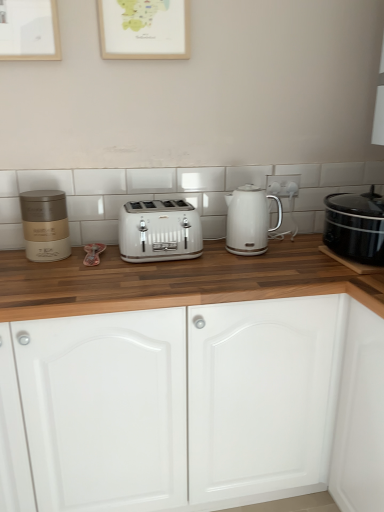
Question: Considering the relative positions of white metallic toaster at center and matte gold container at left in the image provided, is white metallic toaster at center behind matte gold container at left?

Choices:
 (A) no
 (B) yes

Answer: (B)

Question: Is white metallic toaster at center at the left side of matte gold container at left?

Choices:
 (A) yes
 (B) no

Answer: (B)

Question: Is white metallic toaster at center bigger than matte gold container at left?

Choices:
 (A) yes
 (B) no

Answer: (A)

Question: From the image's perspective, is white metallic toaster at center over matte gold container at left?

Choices:
 (A) yes
 (B) no

Answer: (B)

Question: From a real-world perspective, is white metallic toaster at center located beneath matte gold container at left?

Choices:
 (A) no
 (B) yes

Answer: (B)

Question: In terms of width, does wooden picture frame at upper center look wider or thinner when compared to white glossy electric kettle at center?

Choices:
 (A) wide
 (B) thin

Answer: (B)

Question: Considering the relative positions of wooden picture frame at upper center and white glossy electric kettle at center in the image provided, is wooden picture frame at upper center to the left or to the right of white glossy electric kettle at center?

Choices:
 (A) left
 (B) right

Answer: (A)

Question: Based on their sizes in the image, would you say wooden picture frame at upper center is bigger or smaller than white glossy electric kettle at center?

Choices:
 (A) small
 (B) big

Answer: (A)

Question: Is point (102, 34) closer or farther from the camera than point (259, 252)?

Choices:
 (A) farther
 (B) closer

Answer: (B)

Question: From the image's perspective, is white metallic toaster at center positioned above or below matte gold container at left?

Choices:
 (A) above
 (B) below

Answer: (B)

Question: Considering the positions of white metallic toaster at center and matte gold container at left in the image, is white metallic toaster at center bigger or smaller than matte gold container at left?

Choices:
 (A) big
 (B) small

Answer: (A)

Question: In the image, is white metallic toaster at center on the left side or the right side of matte gold container at left?

Choices:
 (A) left
 (B) right

Answer: (B)

Question: Does point (137, 208) appear closer or farther from the camera than point (34, 216)?

Choices:
 (A) farther
 (B) closer

Answer: (A)

Question: Considering the positions of matte gold container at left and wooden picture frame at upper center in the image, is matte gold container at left wider or thinner than wooden picture frame at upper center?

Choices:
 (A) wide
 (B) thin

Answer: (A)

Question: From the image's perspective, is matte gold container at left positioned above or below wooden picture frame at upper center?

Choices:
 (A) above
 (B) below

Answer: (B)